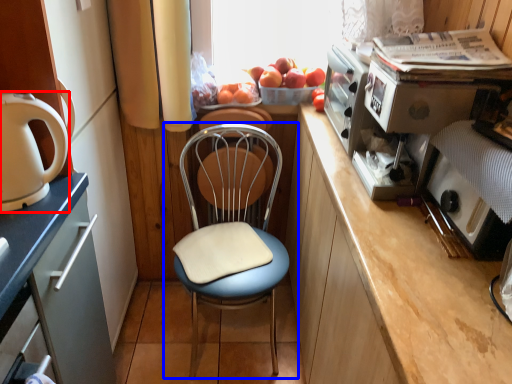
Question: Which point is closer to the camera, home appliance (highlighted by a red box) or chair (highlighted by a blue box)?

Choices:
 (A) home appliance
 (B) chair

Answer: (A)